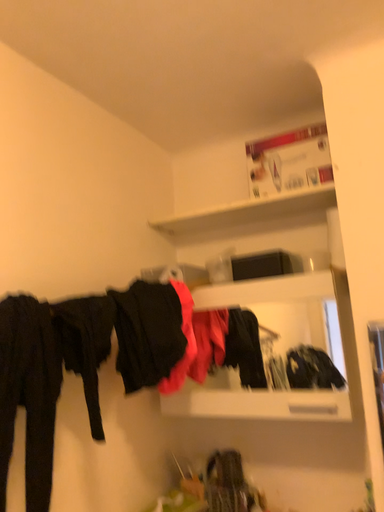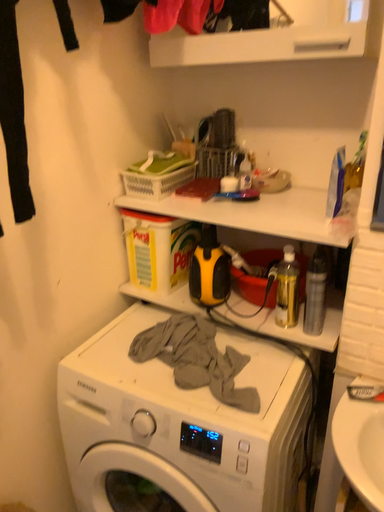
Question: Which way did the camera rotate in the video?

Choices:
 (A) rotated upward
 (B) rotated downward

Answer: (B)